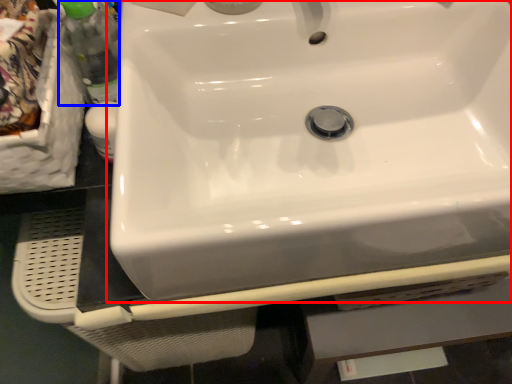
Question: Which point is further to the camera, sink (highlighted by a red box) or bottle (highlighted by a blue box)?

Choices:
 (A) sink
 (B) bottle

Answer: (B)